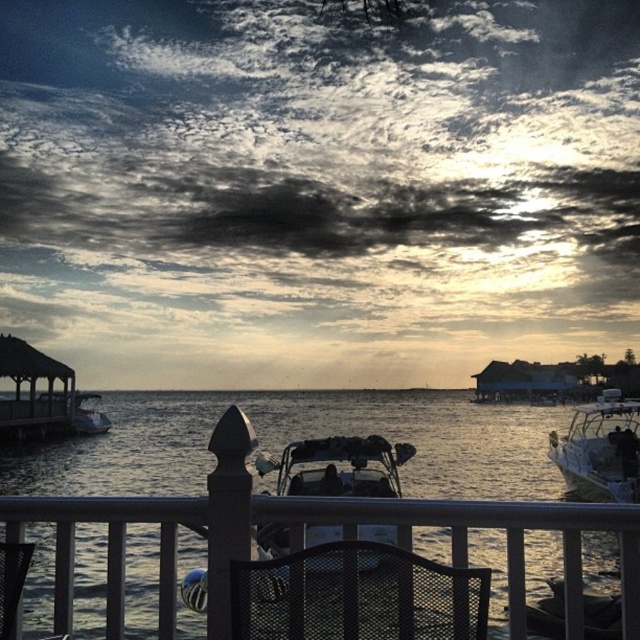
Question: Considering the real-world distances, which object is farthest from the black mesh chair at lower center?

Choices:
 (A) metallic silver boat at center
 (B) white glossy boat at right
 (C) shiny black motorboat at center

Answer: (A)

Question: From the image, what is the correct spatial relationship of translucent water at center in relation to black mesh chair at lower center?

Choices:
 (A) above
 (B) below

Answer: (B)

Question: Is the position of black mesh chair at lower center less distant than that of metallic silver boat at center?

Choices:
 (A) no
 (B) yes

Answer: (B)

Question: Is shiny black motorboat at center thinner than metallic silver boat at center?

Choices:
 (A) yes
 (B) no

Answer: (B)

Question: Among these objects, which one is farthest from the camera?

Choices:
 (A) shiny black motorboat at center
 (B) white glossy boat at right

Answer: (B)

Question: Based on their relative distances, which object is nearer to the metallic silver boat at center?

Choices:
 (A) black mesh chair at lower center
 (B) translucent water at center
 (C) white glossy boat at right

Answer: (B)